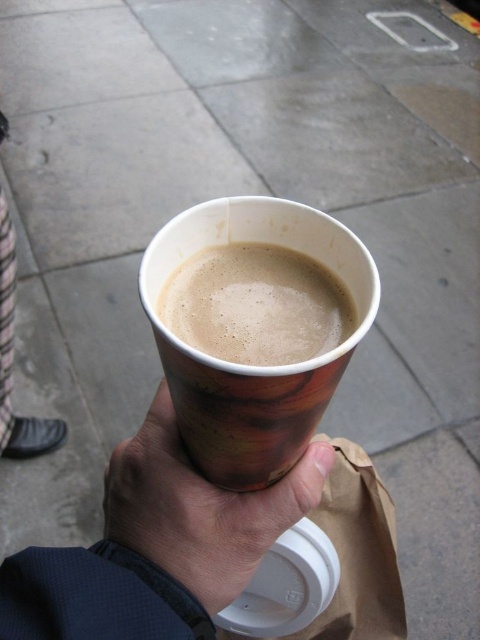
Based on the photo, you are walking on a wet sidewalk and holding a wooden cup at center and a brown paper cup at center. Which cup is closer to your hand?

The wooden cup at center is closer to your hand because it is positioned further to the viewer than the brown paper cup at center.